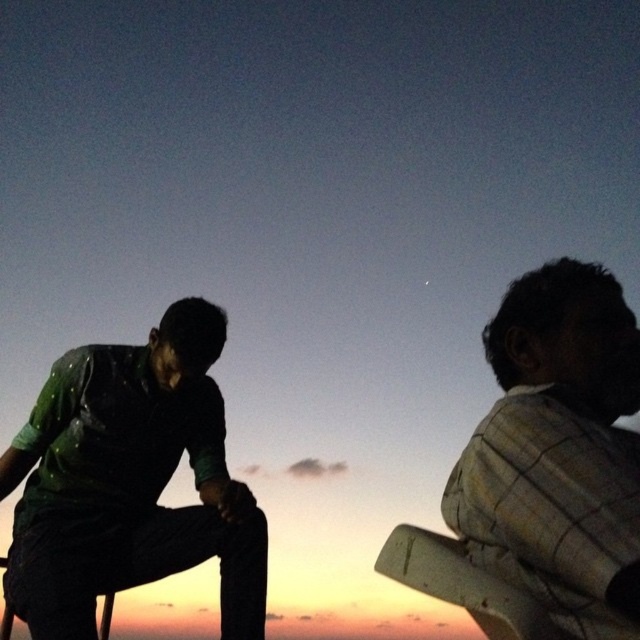
You are a photographer trying to capture the plaid fabric shirt at right in the evening scene. The camera is positioned at the point with coordinates (557, 451). Can you determine if the camera is pointing directly at the plaid fabric shirt at right?

The point with coordinates (557, 451) marks the plaid fabric shirt at right, so yes, the camera is pointing directly at the plaid fabric shirt at right.

You are a photographer trying to capture a silhouette of the two people in the scene. You notice that the plaid fabric shirt at right and the wooden chair at right are both in the frame. Which one will appear taller in the silhouette?

The plaid fabric shirt at right is taller than the wooden chair at right, so it will appear taller in the silhouette.

You are a photographer trying to capture a photo of the green textured pants at left and the wooden chair at right. If you want to ensure both are in the frame, which object should you position closer to the camera to avoid cropping?

The green textured pants at left is positioned on the left side of wooden chair at right, so positioning the wooden chair at right closer to the camera would help ensure both objects remain in the frame without cropping.